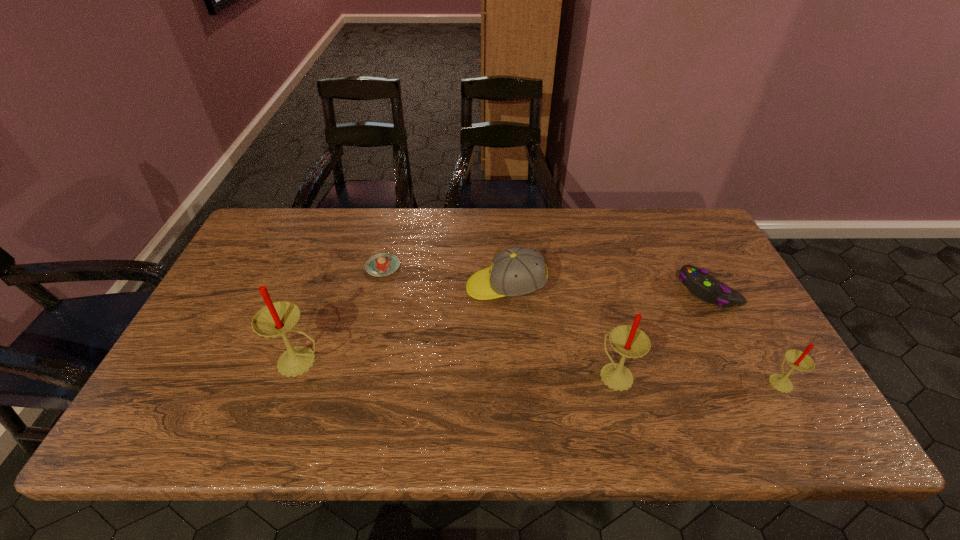
Locate an element on the screen. vacant space located on the right of the second candle from right to left is located at coordinates (777, 374).

Locate an element on the screen. The height and width of the screenshot is (540, 960). vacant space located on the left of the rightmost candle is located at coordinates (636, 381).

This screenshot has height=540, width=960. Identify the location of vacant area situated 0.140m on the front of the second shortest object. (742, 358).

Where is `vacant space located 0.320m on the right of the pastry`? Image resolution: width=960 pixels, height=540 pixels. vacant space located 0.320m on the right of the pastry is located at coordinates (507, 267).

Find the location of a particular element. The height and width of the screenshot is (540, 960). vacant space situated on the front-facing side of the third shortest object is located at coordinates (372, 288).

You are a GUI agent. You are given a task and a screenshot of the screen. Output one action in this format:
    pyautogui.click(x=<x>, y=<y>)
    Task: Click on the vacant area located on the front-facing side of the third shortest object
    The image size is (960, 540).
    Given the screenshot: What is the action you would take?
    pyautogui.click(x=330, y=288)

The height and width of the screenshot is (540, 960). Find the location of `free space located 0.060m on the front-facing side of the third shortest object`. free space located 0.060m on the front-facing side of the third shortest object is located at coordinates (445, 288).

Identify the location of candle present at the right edge. (798, 360).

The height and width of the screenshot is (540, 960). I want to click on control situated at the right edge, so click(698, 281).

Find the location of a particular element. object located in the near right corner section of the desktop is located at coordinates (798, 360).